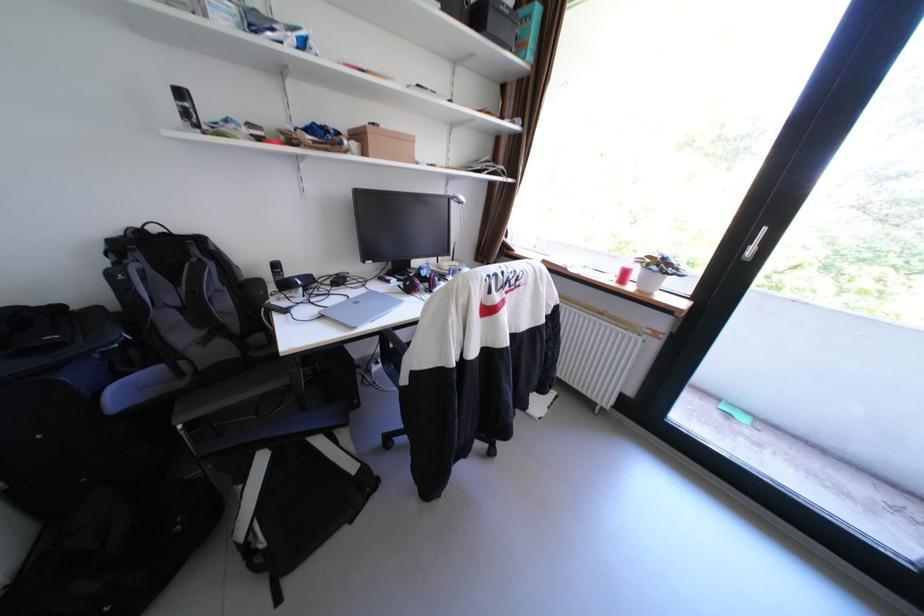
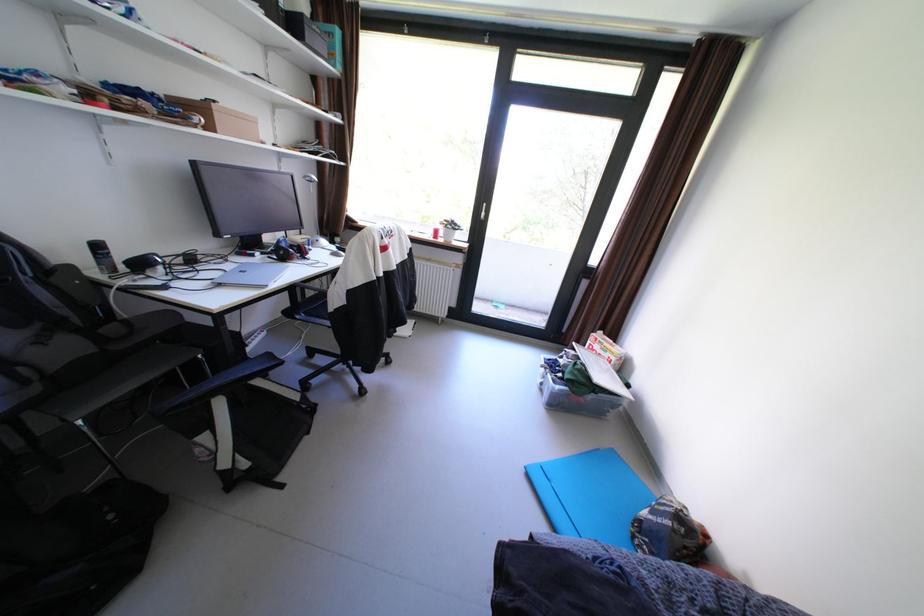
Find the pixel in the second image that matches point 409,281 in the first image.

(274, 254)